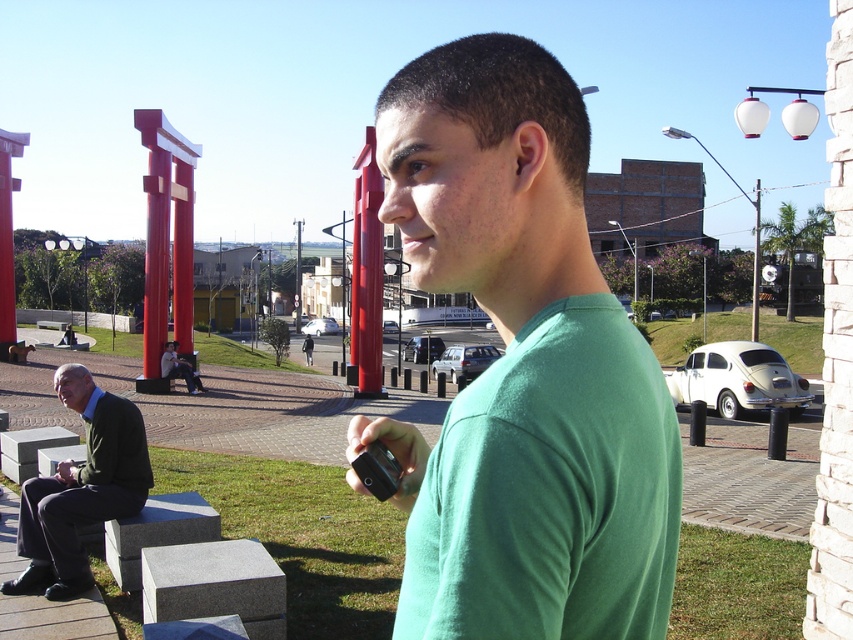
Between dark green suit at lower left and smooth glossy red torii gate at center, which one is positioned higher?

smooth glossy red torii gate at center

Is point (19, 522) less distant than point (181, 196)?

Yes, it is in front of point (181, 196).

Locate an element on the screen. The width and height of the screenshot is (853, 640). dark green suit at lower left is located at coordinates (80, 490).

Is point (80, 392) positioned in front of point (198, 387)?

Yes, point (80, 392) is closer to viewer.

Does dark green suit at lower left appear on the right side of green t-shirt at center?

Indeed, dark green suit at lower left is positioned on the right side of green t-shirt at center.

Is point (45, 582) positioned behind point (199, 388)?

No.

Where is `dark green suit at lower left`? The height and width of the screenshot is (640, 853). dark green suit at lower left is located at coordinates (80, 490).

Does green matte shirt at center have a lesser width compared to smooth glossy red torii gate at center?

Correct, green matte shirt at center's width is less than smooth glossy red torii gate at center's.

Can you confirm if green matte shirt at center is shorter than smooth glossy red torii gate at center?

Indeed, green matte shirt at center has a lesser height compared to smooth glossy red torii gate at center.

Which is behind, point (490, 605) or point (173, 134)?

The point (173, 134) is behind.

Where is `green matte shirt at center`? This screenshot has height=640, width=853. green matte shirt at center is located at coordinates (525, 364).